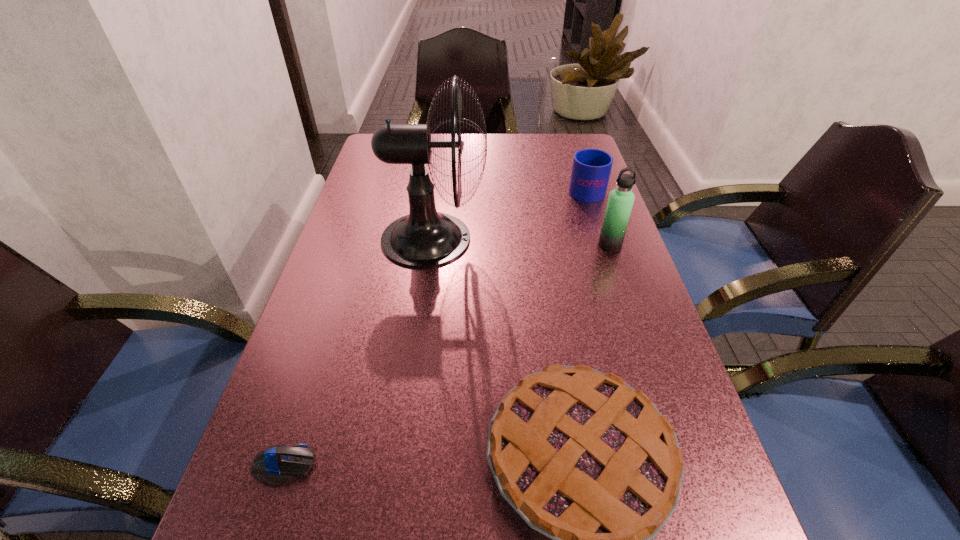
Locate an element on the screen. The height and width of the screenshot is (540, 960). empty location between the shortest object and the thermos bottle is located at coordinates (446, 355).

Find the location of `free space between the mug and the shortest object`. free space between the mug and the shortest object is located at coordinates (435, 327).

Where is `blank region between the shortest object and the fourth shortest object`? The height and width of the screenshot is (540, 960). blank region between the shortest object and the fourth shortest object is located at coordinates (446, 355).

This screenshot has height=540, width=960. Identify the location of vacant region between the mug and the thermos bottle. (598, 217).

Identify which object is the fourth nearest to the mug. Please provide its 2D coordinates. Your answer should be formatted as a tuple, i.e. [(x, y)], where the tuple contains the x and y coordinates of a point satisfying the conditions above.

[(277, 465)]

Where is `object that is the second nearest to the thermos bottle`? This screenshot has width=960, height=540. object that is the second nearest to the thermos bottle is located at coordinates (425, 238).

Locate an element on the screen. The width and height of the screenshot is (960, 540). free region that satisfies the following two spatial constraints: 1. on the front-facing side of the second tallest object; 2. on the right side of the tallest object is located at coordinates (433, 245).